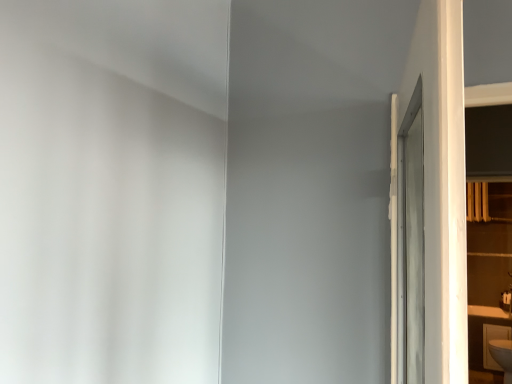
Question: Is white glossy sink at lower right bigger than white glossy shelf at right?

Choices:
 (A) yes
 (B) no

Answer: (B)

Question: Considering the relative positions of white glossy sink at lower right and white glossy shelf at right in the image provided, is white glossy sink at lower right behind white glossy shelf at right?

Choices:
 (A) yes
 (B) no

Answer: (A)

Question: Is white glossy sink at lower right to the right of white glossy shelf at right from the viewer's perspective?

Choices:
 (A) yes
 (B) no

Answer: (A)

Question: From a real-world perspective, is white glossy sink at lower right positioned under white glossy shelf at right based on gravity?

Choices:
 (A) no
 (B) yes

Answer: (B)

Question: Does white glossy sink at lower right turn towards white glossy shelf at right?

Choices:
 (A) no
 (B) yes

Answer: (A)

Question: Is white glossy shelf at right inside white glossy sink at lower right?

Choices:
 (A) no
 (B) yes

Answer: (A)

Question: From a real-world perspective, is white glossy shelf at right beneath white glossy sink at lower right?

Choices:
 (A) no
 (B) yes

Answer: (A)

Question: From the image's perspective, is white glossy shelf at right under white glossy sink at lower right?

Choices:
 (A) yes
 (B) no

Answer: (B)

Question: From the image's perspective, is white glossy shelf at right over white glossy sink at lower right?

Choices:
 (A) no
 (B) yes

Answer: (B)

Question: Would you say white glossy shelf at right is outside white glossy sink at lower right?

Choices:
 (A) yes
 (B) no

Answer: (A)

Question: Is white glossy shelf at right taller than white glossy sink at lower right?

Choices:
 (A) yes
 (B) no

Answer: (A)

Question: Is white glossy sink at lower right completely or partially inside white glossy shelf at right?

Choices:
 (A) no
 (B) yes

Answer: (A)

Question: Looking at their shapes, would you say white glossy sink at lower right is wider or thinner than white glossy shelf at right?

Choices:
 (A) thin
 (B) wide

Answer: (B)